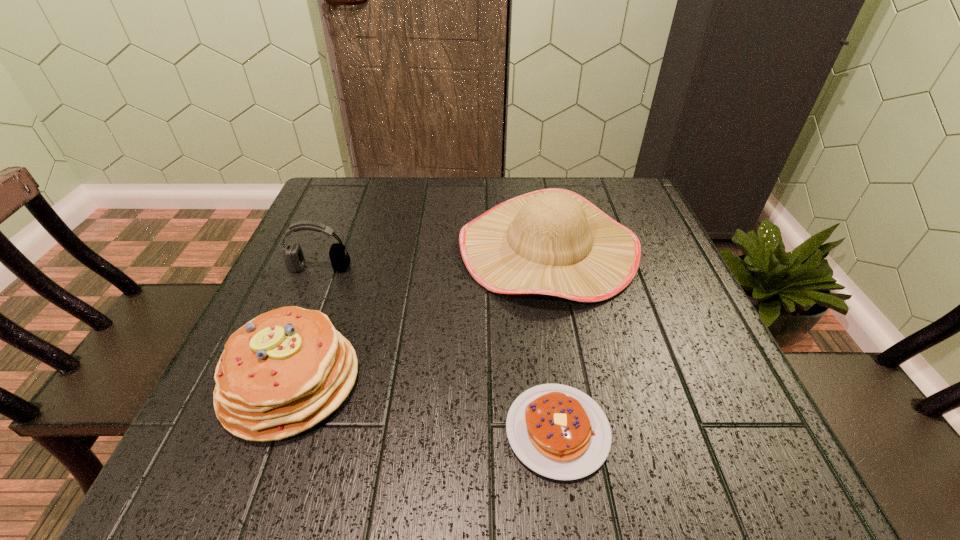
What are the coordinates of `free spot between the left pancake and the right pancake` in the screenshot? It's located at point(424,406).

Identify the location of vacant space that is in between the sunhat and the headset. (434, 258).

The height and width of the screenshot is (540, 960). In order to click on free space between the sunhat and the taller pancake in this screenshot , I will do `click(420, 315)`.

Locate an element on the screen. The height and width of the screenshot is (540, 960). free area in between the shortest object and the headset is located at coordinates (439, 349).

You are a GUI agent. You are given a task and a screenshot of the screen. Output one action in this format:
    pyautogui.click(x=<x>, y=<y>)
    Task: Click on the vacant area that lies between the sunhat and the taller pancake
    Image resolution: width=960 pixels, height=540 pixels.
    Given the screenshot: What is the action you would take?
    pyautogui.click(x=420, y=315)

At what (x,y) coordinates should I click in order to perform the action: click on vacant region between the shorter pancake and the taller pancake. Please return your answer as a coordinate pair (x, y). Image resolution: width=960 pixels, height=540 pixels. Looking at the image, I should click on (424, 406).

Locate an element on the screen. This screenshot has height=540, width=960. vacant area that lies between the sunhat and the left pancake is located at coordinates (420, 315).

Choose which object is the third nearest neighbor to the headset. Please provide its 2D coordinates. Your answer should be formatted as a tuple, i.e. [(x, y)], where the tuple contains the x and y coordinates of a point satisfying the conditions above.

[(558, 431)]

Identify the location of object that is the closest one to the left pancake. This screenshot has width=960, height=540. (294, 258).

Image resolution: width=960 pixels, height=540 pixels. In order to click on vacant space that satisfies the following two spatial constraints: 1. on the headband of the headset; 2. on the left side of the left pancake in this screenshot , I will do `click(274, 382)`.